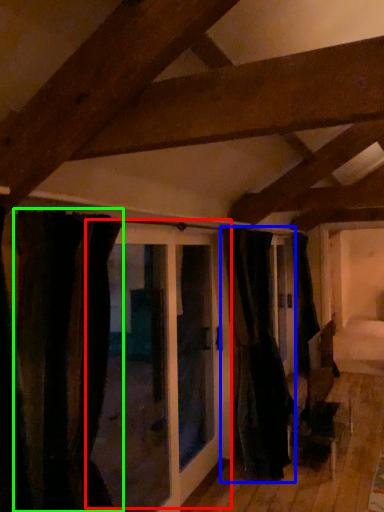
Question: Based on their relative distances, which object is farther from door (highlighted by a red box)? Choose from curtain (highlighted by a blue box) and curtain (highlighted by a green box).

Choices:
 (A) curtain
 (B) curtain

Answer: (B)